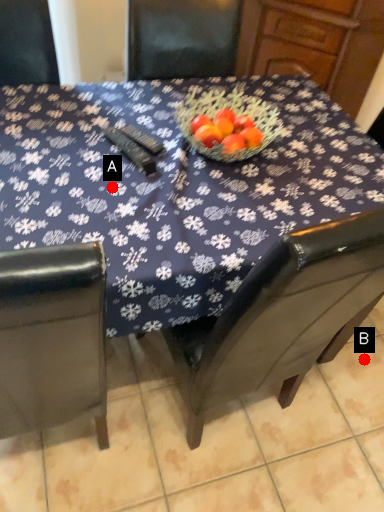
Question: Two points are circled on the image, labeled by A and B beside each circle. Which point is closer to the camera taking this photo?

Choices:
 (A) A is closer
 (B) B is closer

Answer: (A)